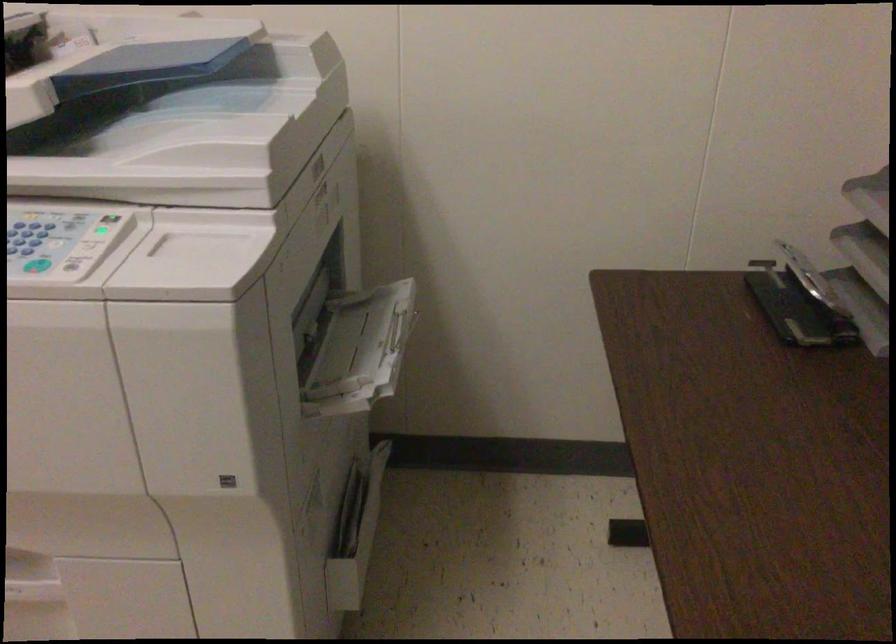
Locate an element on the screen. This screenshot has width=896, height=644. green printer button is located at coordinates (38, 265).